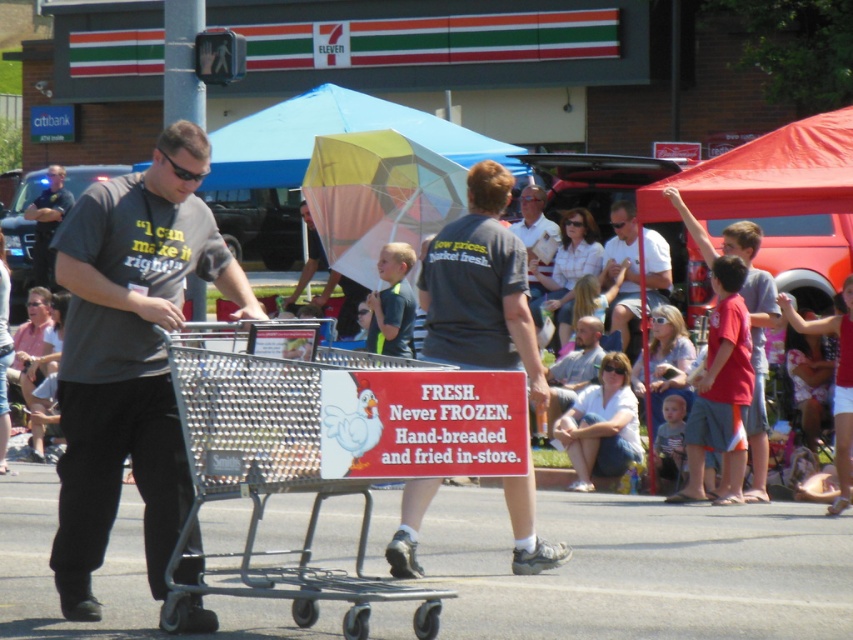
Question: Which object is positioned closest to the dark gray uniform at left?

Choices:
 (A) dark gray t-shirt at left
 (B) dark gray t-shirt at center
 (C) silver metallic shopping cart at center

Answer: (B)

Question: In this image, where is dark gray t-shirt at left located relative to dark gray uniform at left?

Choices:
 (A) right
 (B) left

Answer: (A)

Question: Which object is closer to the camera taking this photo?

Choices:
 (A) dark gray t-shirt at left
 (B) dark gray uniform at left
 (C) dark gray t-shirt at center

Answer: (A)

Question: Which point is farther to the camera?

Choices:
 (A) gray t-shirt at center
 (B) dark gray uniform at left
 (C) dark gray t-shirt at left

Answer: (B)

Question: In this image, where is silver metallic shopping cart at center located relative to gray t-shirt at center?

Choices:
 (A) left
 (B) right

Answer: (B)

Question: Is dark gray t-shirt at center bigger than white matte shirt at upper center?

Choices:
 (A) no
 (B) yes

Answer: (A)